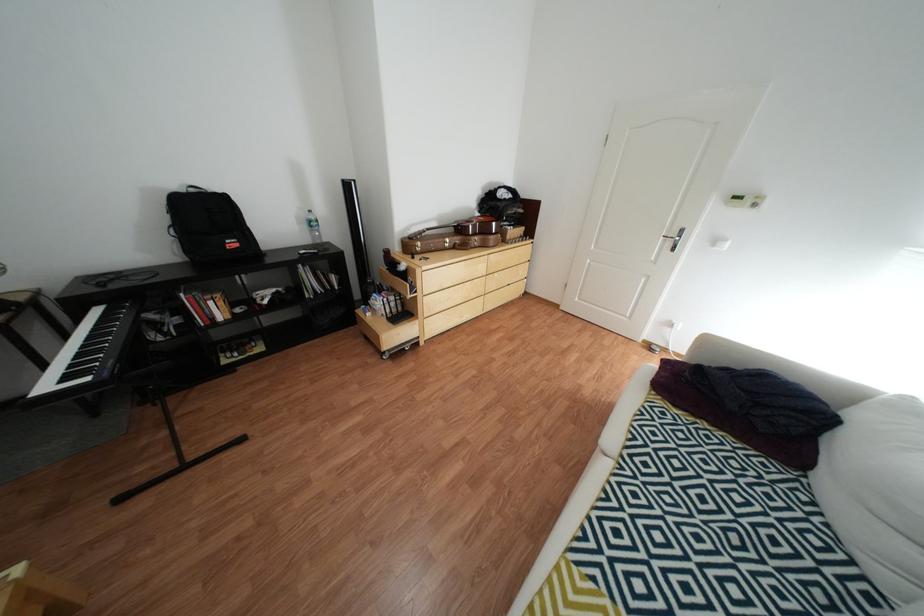
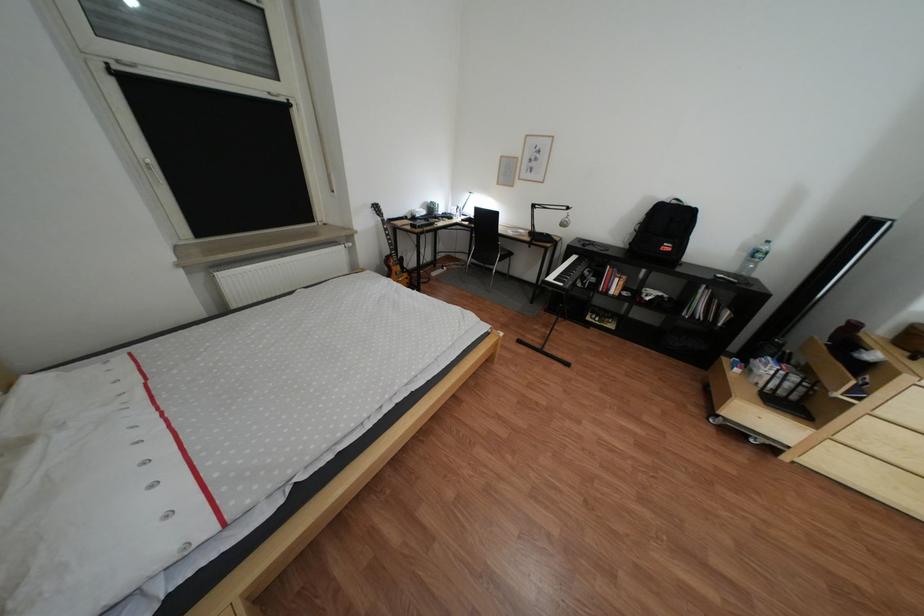
In the second image, find the point that corresponds to the point at 322,227 in the first image.

(760, 256)